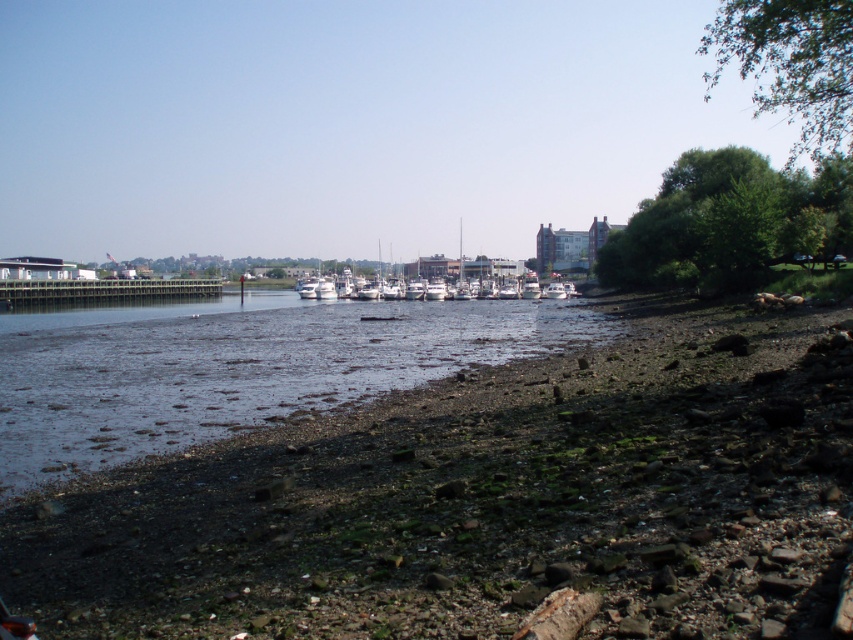
Question: Which point appears closest to the camera in this image?

Choices:
 (A) (425, 333)
 (B) (624, 540)

Answer: (B)

Question: Can you confirm if dull brown pebbles at lower left is positioned to the left of brown gravel river at center?

Choices:
 (A) yes
 (B) no

Answer: (B)

Question: Which point is farther to the camera?

Choices:
 (A) brown gravel river at center
 (B) white glossy boats at center
 (C) white glossy boat at center

Answer: (B)

Question: Which point is closer to the camera?

Choices:
 (A) white glossy boats at center
 (B) dull brown pebbles at lower left
 (C) white glossy boat at center
 (D) brown gravel river at center

Answer: (B)

Question: Does dull brown pebbles at lower left appear on the right side of brown gravel river at center?

Choices:
 (A) yes
 (B) no

Answer: (A)

Question: Is white glossy boats at center thinner than white glossy boat at center?

Choices:
 (A) yes
 (B) no

Answer: (B)